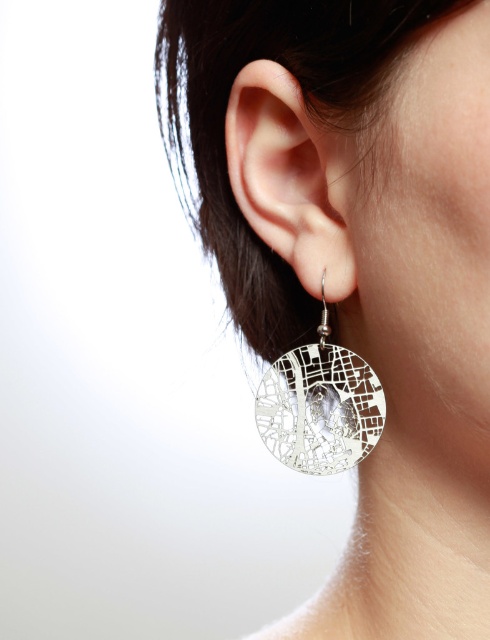
Does silver metallic earrings at lower right have a greater width compared to silver/metallic/earring at lower right?

Correct, the width of silver metallic earrings at lower right exceeds that of silver/metallic/earring at lower right.

Between silver metallic earrings at lower right and silver/metallic/earring at lower right, which one has less height?

silver/metallic/earring at lower right

Is point (335, 157) farther from viewer compared to point (353, 429)?

No, it is in front of (353, 429).

The height and width of the screenshot is (640, 490). I want to click on silver metallic earrings at lower right, so click(361, 260).

Which is in front, point (289, 253) or point (297, 266)?

Point (297, 266) is more forward.

Can you confirm if silver metallic earrings at lower right is positioned above silver metallic earring at center-left?

Actually, silver metallic earrings at lower right is below silver metallic earring at center-left.

Between point (437, 544) and point (290, 76), which one is positioned behind?

The point (437, 544) is more distant.

You are a GUI agent. You are given a task and a screenshot of the screen. Output one action in this format:
    pyautogui.click(x=<x>, y=<y>)
    Task: Click on the silver metallic earrings at lower right
    The width and height of the screenshot is (490, 640).
    Given the screenshot: What is the action you would take?
    pyautogui.click(x=361, y=260)

Does silver metallic earring at center-left appear on the right side of silver/metallic/earring at lower right?

Incorrect, silver metallic earring at center-left is not on the right side of silver/metallic/earring at lower right.

Which is below, silver metallic earring at center-left or silver/metallic/earring at lower right?

Positioned lower is silver/metallic/earring at lower right.

At what (x,y) coordinates should I click in order to perform the action: click on silver metallic earring at center-left. Please return your answer as a coordinate pair (x, y). The height and width of the screenshot is (640, 490). Looking at the image, I should click on (293, 177).

Locate an element on the screen. silver metallic earring at center-left is located at coordinates (293, 177).